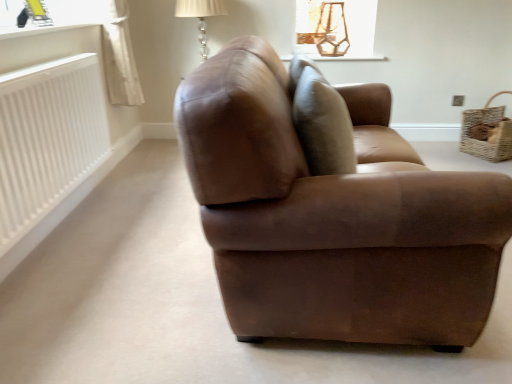
Question: Is brown leather swivel chair at center closer to the viewer compared to woven brown basket at right?

Choices:
 (A) no
 (B) yes

Answer: (B)

Question: Is brown leather swivel chair at center to the right of woven brown basket at right from the viewer's perspective?

Choices:
 (A) yes
 (B) no

Answer: (B)

Question: Is brown leather swivel chair at center positioned behind woven brown basket at right?

Choices:
 (A) no
 (B) yes

Answer: (A)

Question: From a real-world perspective, is brown leather swivel chair at center physically above woven brown basket at right?

Choices:
 (A) no
 (B) yes

Answer: (B)

Question: Is brown leather swivel chair at center facing towards woven brown basket at right?

Choices:
 (A) no
 (B) yes

Answer: (A)

Question: Is brown leather swivel chair at center touching woven brown basket at right?

Choices:
 (A) yes
 (B) no

Answer: (B)

Question: Is matte white wood at upper center, which ranks as the 1th window sill in back-to-front order, not inside woven brown basket at right?

Choices:
 (A) no
 (B) yes

Answer: (B)

Question: Can you confirm if matte white wood at upper center, which is the 2th window sill in left-to-right order, is taller than woven brown basket at right?

Choices:
 (A) yes
 (B) no

Answer: (B)

Question: From the image's perspective, is matte white wood at upper center, which is the 2th window sill in left-to-right order, beneath woven brown basket at right?

Choices:
 (A) yes
 (B) no

Answer: (B)

Question: Are matte white wood at upper center, which is the 2th window sill in left-to-right order, and woven brown basket at right making contact?

Choices:
 (A) no
 (B) yes

Answer: (A)

Question: Is the depth of matte white wood at upper center, which ranks as the 1th window sill in back-to-front order, greater than that of woven brown basket at right?

Choices:
 (A) no
 (B) yes

Answer: (B)

Question: From the image's perspective, does matte white wood at upper center, the 1th window sill viewed from the right, appear higher than woven brown basket at right?

Choices:
 (A) no
 (B) yes

Answer: (B)

Question: Does brown leather couch at center have a larger size compared to brown leather swivel chair at center?

Choices:
 (A) no
 (B) yes

Answer: (B)